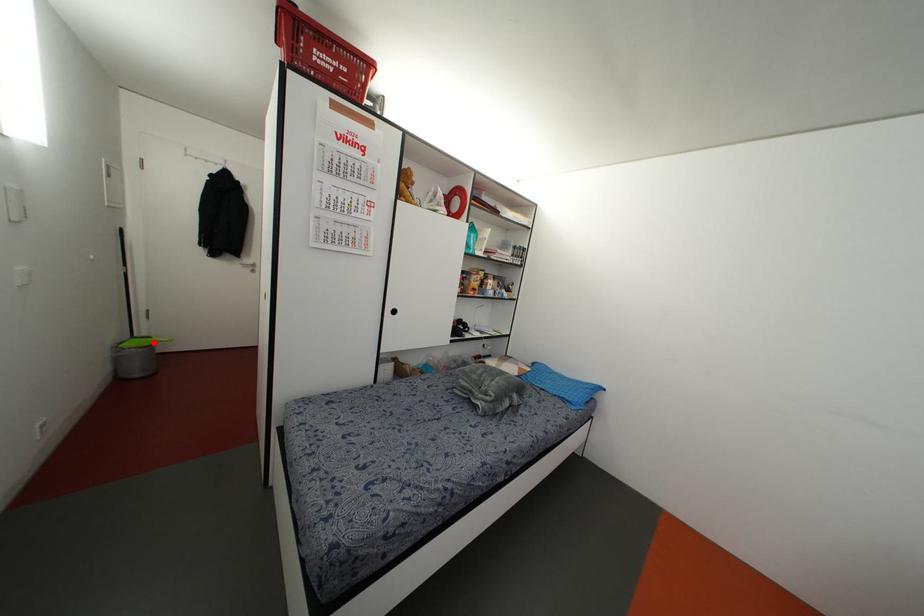
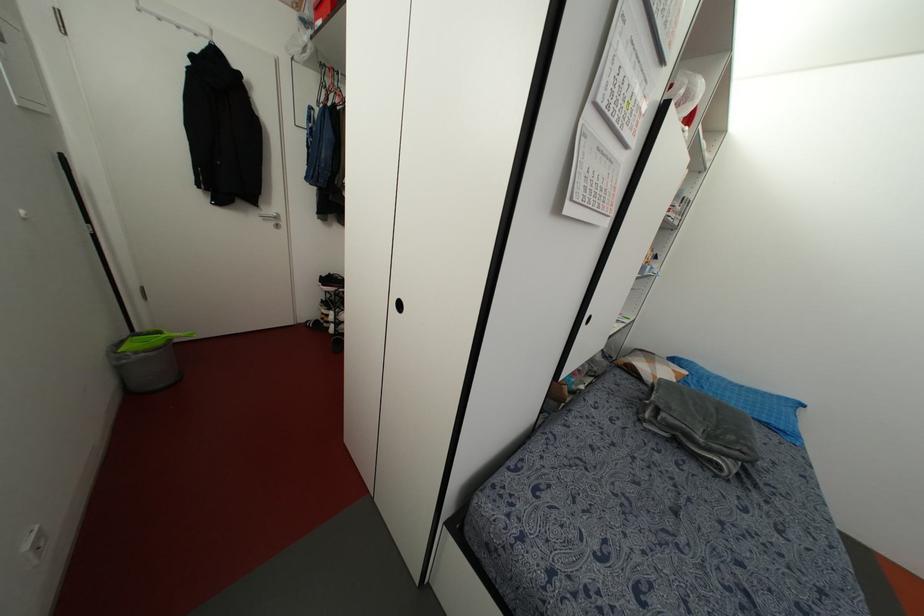
In the second image, find the point that corresponds to the highlighted location in the first image.

(168, 339)